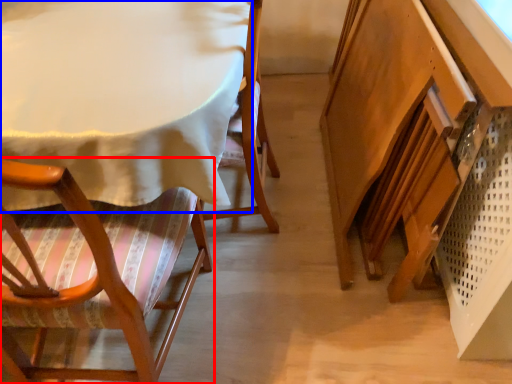
Question: Which object appears closest to the camera in this image, chair (highlighted by a red box) or table (highlighted by a blue box)?

Choices:
 (A) chair
 (B) table

Answer: (A)